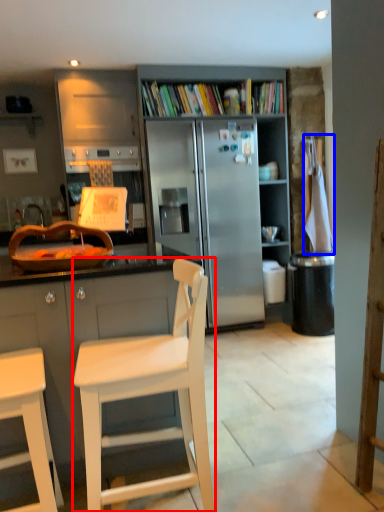
Question: Which of the following is the farthest to the observer, chair (highlighted by a red box) or towel/napkin (highlighted by a blue box)?

Choices:
 (A) chair
 (B) towel/napkin

Answer: (B)